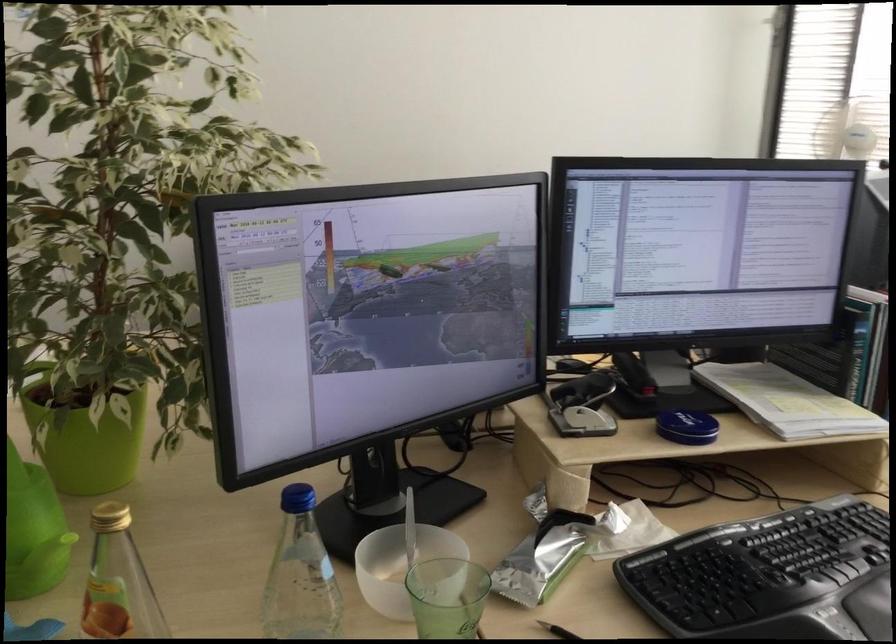
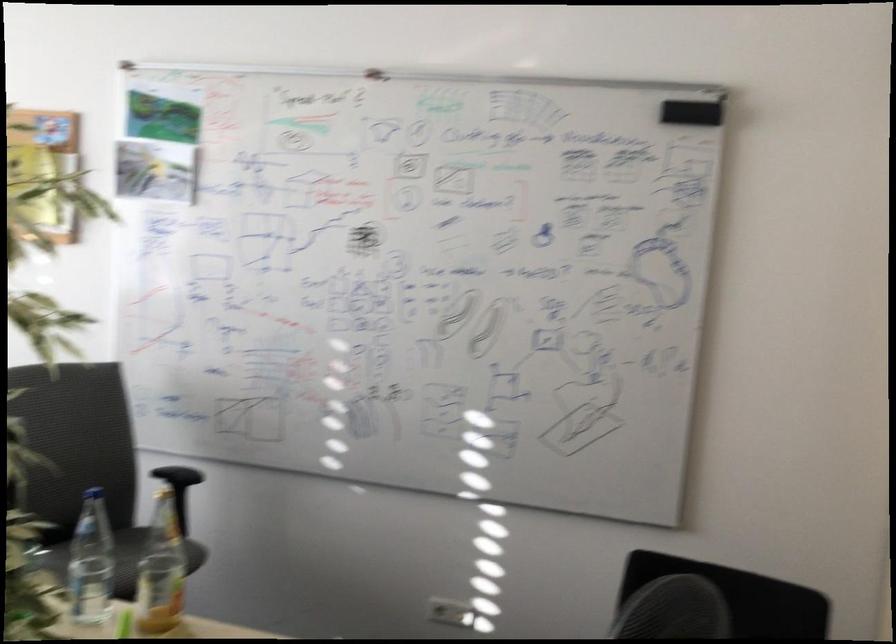
Question: I am providing you with two images of the same scene from different viewpoints. After the viewpoint changes to image2, which objects are now occluded?

Choices:
 (A) gold bottle cap
 (B) black chair armrest
 (C) clear water bottle
 (D) metal tumbler

Answer: (A)